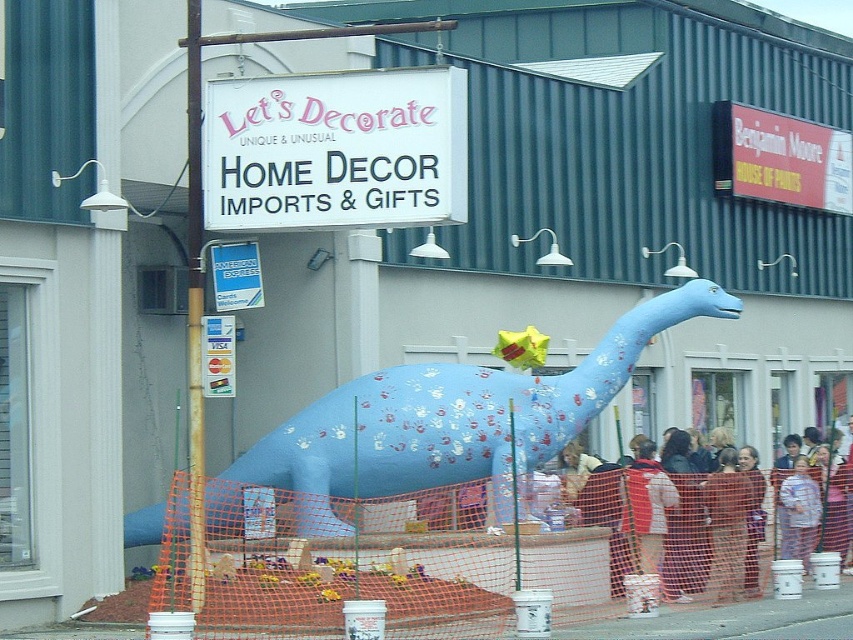
Question: Is blue matte dinosaur at center above blue plastic sign at upper center?

Choices:
 (A) no
 (B) yes

Answer: (A)

Question: From the image, what is the correct spatial relationship of blue matte dinosaur at center in relation to metallic credit card at center?

Choices:
 (A) right
 (B) left

Answer: (A)

Question: Which object is the farthest from the blue plastic sign at upper center?

Choices:
 (A) metallic credit card at center
 (B) blue matte dinosaur at center
 (C) red plastic sign at upper right
 (D) light brown fabric jacket at lower right

Answer: (C)

Question: Considering the relative positions of white plastic sign at upper center and light brown fabric jacket at lower right in the image provided, where is white plastic sign at upper center located with respect to light brown fabric jacket at lower right?

Choices:
 (A) below
 (B) above

Answer: (B)

Question: Which of the following is the farthest from the observer?

Choices:
 (A) (206, 330)
 (B) (254, 284)

Answer: (B)

Question: Which is farther from the white plastic sign at upper center?

Choices:
 (A) blue matte dinosaur at center
 (B) red plastic sign at upper right
 (C) blue plastic sign at upper center

Answer: (B)